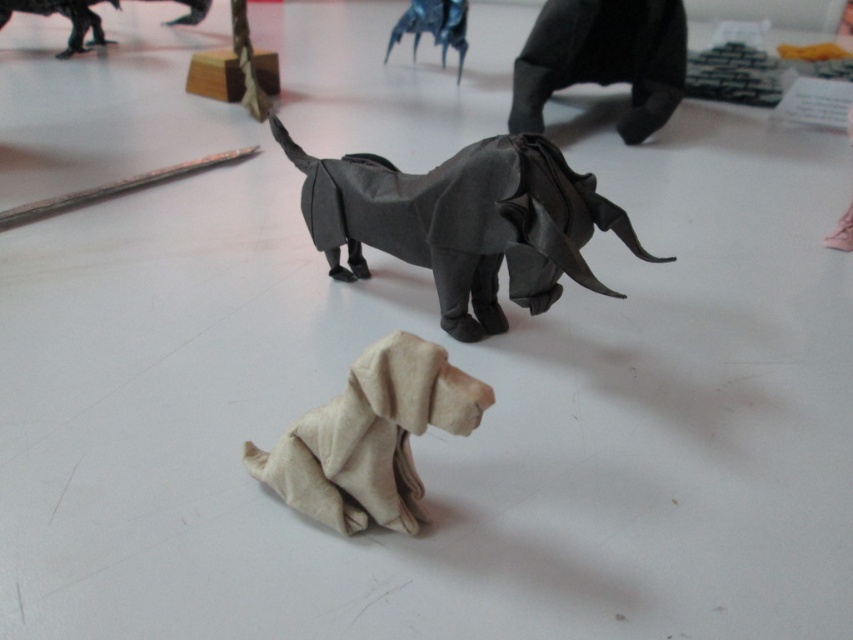
You are a photographer standing 1.5 meters away from the dark gray paper elephant at center. You want to take a closeup photo of it. Do you need to move closer or farther away?

The dark gray paper elephant at center is 1.05 meters from the camera. Since you are currently 1.5 meters away, you need to move closer to the dark gray paper elephant at center to take a closeup photo.

What is located at the coordinates point (463, 221)?

At point (463, 221) lies dark gray paper elephant at center.

Where is the dark gray paper elephant at center located in the coordinate system?

The dark gray paper elephant at center is located at point [463,221].